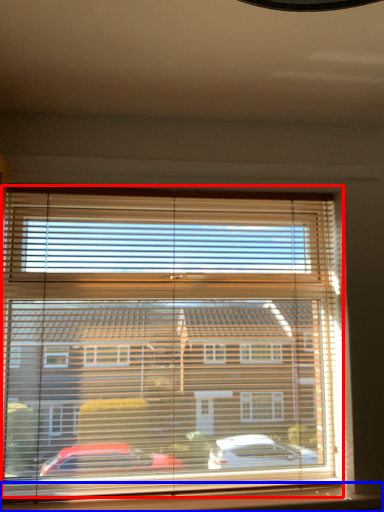
Question: Which object is further to the camera taking this photo, bay window (highlighted by a red box) or window sill (highlighted by a blue box)?

Choices:
 (A) bay window
 (B) window sill

Answer: (A)